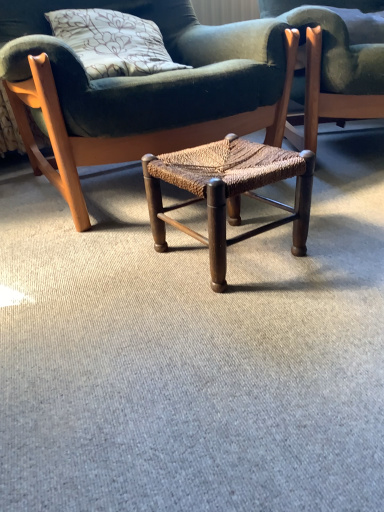
The image size is (384, 512). What do you see at coordinates (228, 191) in the screenshot?
I see `woven wood stool at center` at bounding box center [228, 191].

Describe the element at coordinates (112, 42) in the screenshot. I see `velvet floral pillow at upper left` at that location.

The height and width of the screenshot is (512, 384). Describe the element at coordinates (337, 57) in the screenshot. I see `woven wood chair at center, arranged as the 1th chair when viewed from the right` at that location.

Find the location of a particular element. The image size is (384, 512). woven wood stool at center is located at coordinates (228, 191).

Do you think velvet floral pillow at upper left is within woven wood stool at center, or outside of it?

velvet floral pillow at upper left lies outside woven wood stool at center.

You are a GUI agent. You are given a task and a screenshot of the screen. Output one action in this format:
    pyautogui.click(x=<x>, y=<y>)
    Task: Click on the stool on the right of velvet floral pillow at upper left
    
    Given the screenshot: What is the action you would take?
    pyautogui.click(x=228, y=191)

Which object is positioned more to the left, velvet floral pillow at upper left or woven wood stool at center?

Positioned to the left is velvet floral pillow at upper left.

Does velvet floral pillow at upper left turn towards woven wood stool at center?

No, velvet floral pillow at upper left does not turn towards woven wood stool at center.

Is point (88, 4) behind point (298, 255)?

Yes, point (88, 4) is farther from viewer.

Is woven wood stool at center, the second chair from the right, positioned in front of woven wood stool at center?

That is False.

Is woven wood stool at center, the first chair viewed from the left, outside of woven wood stool at center?

Yes, woven wood stool at center, the first chair viewed from the left, is located beyond the bounds of woven wood stool at center.

Is velvet floral pillow at upper left further to camera compared to woven wood stool at center, the second chair from the right?

Yes.

In the scene shown: Is velvet floral pillow at upper left not near woven wood stool at center, the first chair viewed from the left?

No, velvet floral pillow at upper left is not far from woven wood stool at center, the first chair viewed from the left.

Could you tell me if velvet floral pillow at upper left is turned towards woven wood stool at center, the first chair viewed from the left?

Yes, velvet floral pillow at upper left is aimed at woven wood stool at center, the first chair viewed from the left.

From a real-world perspective, is velvet floral pillow at upper left below woven wood stool at center, the first chair viewed from the left?

No, from a real-world perspective, velvet floral pillow at upper left is not beneath woven wood stool at center, the first chair viewed from the left.

Locate an element on the screen. The image size is (384, 512). chair above the velvet floral pillow at upper left (from the image's perspective) is located at coordinates (337, 57).

Measure the distance from woven wood chair at center, marked as the second chair in a left-to-right arrangement, to velvet floral pillow at upper left.

woven wood chair at center, marked as the second chair in a left-to-right arrangement, is 21.30 inches away from velvet floral pillow at upper left.

Which of these two, woven wood chair at center, arranged as the 1th chair when viewed from the right, or velvet floral pillow at upper left, is smaller?

Smaller between the two is velvet floral pillow at upper left.

How many degrees apart are the facing directions of woven wood chair at center, marked as the second chair in a left-to-right arrangement, and velvet floral pillow at upper left?

28.4 degrees.

Is woven wood stool at center, the first chair viewed from the left, inside the boundaries of velvet floral pillow at upper left, or outside?

woven wood stool at center, the first chair viewed from the left, is outside velvet floral pillow at upper left.

Which of these two, woven wood stool at center, the first chair viewed from the left, or velvet floral pillow at upper left, is smaller?

velvet floral pillow at upper left.

Is woven wood stool at center, the second chair from the right, wider than velvet floral pillow at upper left?

Yes.

Is woven wood stool at center, the second chair from the right, turned away from velvet floral pillow at upper left?

Absolutely, woven wood stool at center, the second chair from the right, is directed away from velvet floral pillow at upper left.

Who is smaller, woven wood stool at center or woven wood chair at center, arranged as the 1th chair when viewed from the right?

woven wood stool at center is smaller.

From the picture: From the image's perspective, does woven wood stool at center appear higher than woven wood chair at center, arranged as the 1th chair when viewed from the right?

No.

Which is closer to the camera, (250, 167) or (372, 108)?

The point (250, 167) is closer.

Between point (239, 162) and point (98, 58), which one is positioned in front?

The point (239, 162) is closer to the camera.

In the scene shown: Is woven wood stool at center looking in the opposite direction of velvet floral pillow at upper left?

Correct, woven wood stool at center is looking away from velvet floral pillow at upper left.

Considering the relative sizes of woven wood stool at center and velvet floral pillow at upper left in the image provided, is woven wood stool at center wider than velvet floral pillow at upper left?

No.

Consider the image. Is woven wood stool at center taller than velvet floral pillow at upper left?

No.

This screenshot has width=384, height=512. Find the location of `pillow to the left of woven wood stool at center`. pillow to the left of woven wood stool at center is located at coordinates (112, 42).

The image size is (384, 512). In order to click on stool lying in front of the woven wood stool at center, the second chair from the right in this screenshot , I will do `click(228, 191)`.

Estimate the real-world distances between objects in this image. Which object is further from woven wood stool at center, the first chair viewed from the left, woven wood stool at center or velvet floral pillow at upper left?

woven wood stool at center is positioned further to the anchor woven wood stool at center, the first chair viewed from the left.

When comparing their distances from woven wood stool at center, the first chair viewed from the left, does woven wood chair at center, arranged as the 1th chair when viewed from the right, or woven wood stool at center seem closer?

Based on the image, woven wood stool at center appears to be nearer to woven wood stool at center, the first chair viewed from the left.

Looking at the image, which one is located closer to woven wood chair at center, marked as the second chair in a left-to-right arrangement, woven wood stool at center or velvet floral pillow at upper left?

Among the two, woven wood stool at center is located nearer to woven wood chair at center, marked as the second chair in a left-to-right arrangement.

Considering their positions, is woven wood chair at center, marked as the second chair in a left-to-right arrangement, positioned closer to velvet floral pillow at upper left than woven wood stool at center, the first chair viewed from the left?

woven wood stool at center, the first chair viewed from the left, lies closer to velvet floral pillow at upper left than the other object.

When comparing their distances from woven wood stool at center, does woven wood stool at center, the first chair viewed from the left, or woven wood chair at center, arranged as the 1th chair when viewed from the right, seem further?

woven wood chair at center, arranged as the 1th chair when viewed from the right, is positioned further to the anchor woven wood stool at center.

When comparing their distances from velvet floral pillow at upper left, does woven wood stool at center, the first chair viewed from the left, or woven wood chair at center, marked as the second chair in a left-to-right arrangement, seem further?

The object further to velvet floral pillow at upper left is woven wood chair at center, marked as the second chair in a left-to-right arrangement.

Looking at the image, which one is located closer to woven wood stool at center, the first chair viewed from the left, velvet floral pillow at upper left or woven wood stool at center?

velvet floral pillow at upper left is positioned closer to the anchor woven wood stool at center, the first chair viewed from the left.

Estimate the real-world distances between objects in this image. Which object is further from woven wood chair at center, marked as the second chair in a left-to-right arrangement, woven wood stool at center, the first chair viewed from the left, or woven wood stool at center?

woven wood stool at center lies further to woven wood chair at center, marked as the second chair in a left-to-right arrangement, than the other object.

You are a GUI agent. You are given a task and a screenshot of the screen. Output one action in this format:
    pyautogui.click(x=<x>, y=<y>)
    Task: Click on the chair between velvet floral pillow at upper left and woven wood stool at center in the up-down direction
    
    Given the screenshot: What is the action you would take?
    pyautogui.click(x=141, y=88)

The height and width of the screenshot is (512, 384). Find the location of `stool between velvet floral pillow at upper left and woven wood chair at center, marked as the second chair in a left-to-right arrangement`. stool between velvet floral pillow at upper left and woven wood chair at center, marked as the second chair in a left-to-right arrangement is located at coordinates (228, 191).

Find the location of a particular element. The width and height of the screenshot is (384, 512). chair between velvet floral pillow at upper left and woven wood chair at center, marked as the second chair in a left-to-right arrangement, in the horizontal direction is located at coordinates (141, 88).

Where is `stool located between woven wood stool at center, the second chair from the right, and woven wood chair at center, marked as the second chair in a left-to-right arrangement, in the left-right direction`? stool located between woven wood stool at center, the second chair from the right, and woven wood chair at center, marked as the second chair in a left-to-right arrangement, in the left-right direction is located at coordinates (228, 191).